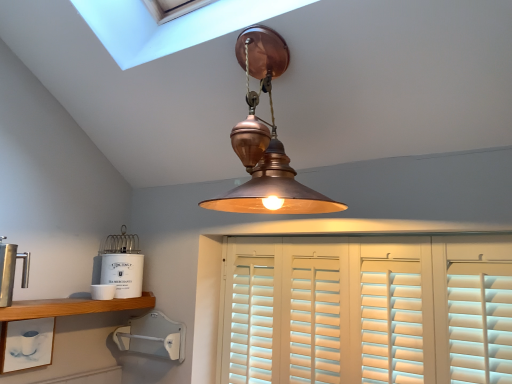
What do you see at coordinates (103, 291) in the screenshot? Image resolution: width=512 pixels, height=384 pixels. I see `white ceramic container at lower left, which appears as the second appliance when ordered from the bottom` at bounding box center [103, 291].

How much space does white ceramic container at lower left, the 3th appliance positioned from the top, occupy horizontally?

The width of white ceramic container at lower left, the 3th appliance positioned from the top, is 8.36 centimeters.

What do you see at coordinates (71, 307) in the screenshot? The width and height of the screenshot is (512, 384). I see `wooden shelf at lower left, the 1th shelf positioned from the top` at bounding box center [71, 307].

What do you see at coordinates (122, 264) in the screenshot? I see `white matte tea canister at left, which ranks as the third appliance in bottom-to-top order` at bounding box center [122, 264].

Find the location of a particular element. Image resolution: width=512 pixels, height=384 pixels. white plastic wall mount at lower left, which ranks as the first appliance in bottom-to-top order is located at coordinates (153, 336).

This screenshot has height=384, width=512. What do you see at coordinates (368, 310) in the screenshot?
I see `white wood shutters at center` at bounding box center [368, 310].

This screenshot has width=512, height=384. I want to click on white ceramic container at lower left, which appears as the second appliance when ordered from the bottom, so click(103, 291).

Is point (152, 315) behind point (125, 279)?

Yes, point (152, 315) is behind point (125, 279).

Where is `appliance on the right side of white matte tea canister at left, which is counted as the 2th appliance, starting from the top`? The width and height of the screenshot is (512, 384). appliance on the right side of white matte tea canister at left, which is counted as the 2th appliance, starting from the top is located at coordinates (153, 336).

Could you tell me if white plastic wall mount at lower left, the 4th appliance viewed from the top, is facing white matte tea canister at left, which is counted as the 2th appliance, starting from the top?

No, white plastic wall mount at lower left, the 4th appliance viewed from the top, does not turn towards white matte tea canister at left, which is counted as the 2th appliance, starting from the top.

Are wooden shelf at lower left, the 1th shelf positioned from the top, and copper pendant light at center far apart?

wooden shelf at lower left, the 1th shelf positioned from the top, is actually quite close to copper pendant light at center.

Considering the positions of point (23, 311) and point (249, 203), is point (23, 311) closer or farther from the camera than point (249, 203)?

Point (23, 311) appears to be farther away from the viewer than point (249, 203).

Consider the image. From a real-world perspective, relative to copper pendant light at center, is wooden shelf at lower left, acting as the 2th shelf starting from the bottom, vertically above or below?

From a real-world perspective, wooden shelf at lower left, acting as the 2th shelf starting from the bottom, is physically below copper pendant light at center.

Is wooden shelf at lower left, the 1th shelf positioned from the top, oriented towards copper pendant light at center?

No, wooden shelf at lower left, the 1th shelf positioned from the top, is not aimed at copper pendant light at center.

Does polished stainless steel coffee press at left, which ranks as the fourth appliance in bottom-to-top order, lie behind white matte tea canister at left, which ranks as the third appliance in bottom-to-top order?

No, the depth of polished stainless steel coffee press at left, which ranks as the fourth appliance in bottom-to-top order, is less than that of white matte tea canister at left, which ranks as the third appliance in bottom-to-top order.

Considering the positions of points (23, 259) and (118, 281), is point (23, 259) farther from camera compared to point (118, 281)?

No, (23, 259) is in front of (118, 281).

Identify the location of appliance above the white matte tea canister at left, which is counted as the 2th appliance, starting from the top (from a real-world perspective). This screenshot has height=384, width=512. (11, 271).

From a real-world perspective, which is physically above, polished stainless steel coffee press at left, which ranks as the fourth appliance in bottom-to-top order, or white matte tea canister at left, which ranks as the third appliance in bottom-to-top order?

polished stainless steel coffee press at left, which ranks as the fourth appliance in bottom-to-top order, is physically above.

Is white matte tea canister at left, which ranks as the third appliance in bottom-to-top order, aimed at white matte cup at lower left, the 2th shelf in the top-to-bottom sequence?

No.

What's the angular difference between white matte tea canister at left, which is counted as the 2th appliance, starting from the top, and white matte cup at lower left, placed as the 1th shelf when sorted from bottom to top,'s facing directions?

The angular difference between white matte tea canister at left, which is counted as the 2th appliance, starting from the top, and white matte cup at lower left, placed as the 1th shelf when sorted from bottom to top, is 7.1 degrees.

Is white matte tea canister at left, which ranks as the third appliance in bottom-to-top order, not inside white matte cup at lower left, placed as the 1th shelf when sorted from bottom to top?

That's correct, white matte tea canister at left, which ranks as the third appliance in bottom-to-top order, is outside of white matte cup at lower left, placed as the 1th shelf when sorted from bottom to top.

Which point is more forward, (135, 234) or (42, 348)?

The point (42, 348) is closer.

From the image's perspective, is white wood shutters at center positioned above or below copper pendant light at center?

white wood shutters at center is situated lower than copper pendant light at center in the image.

Consider the image. Is white wood shutters at center aimed at copper pendant light at center?

No, white wood shutters at center is not aimed at copper pendant light at center.

Find the location of a particular element. lamp positioned vertically above the white wood shutters at center (from a real-world perspective) is located at coordinates (266, 140).

Which of these two, white matte cup at lower left, placed as the 1th shelf when sorted from bottom to top, or white plastic wall mount at lower left, the 4th appliance viewed from the top, is bigger?

With larger size is white plastic wall mount at lower left, the 4th appliance viewed from the top.

Could you tell me if white matte cup at lower left, placed as the 1th shelf when sorted from bottom to top, is facing white plastic wall mount at lower left, the 4th appliance viewed from the top?

No, white matte cup at lower left, placed as the 1th shelf when sorted from bottom to top, is not oriented towards white plastic wall mount at lower left, the 4th appliance viewed from the top.

Is white matte cup at lower left, placed as the 1th shelf when sorted from bottom to top, taller or shorter than white plastic wall mount at lower left, which ranks as the first appliance in bottom-to-top order?

Clearly, white matte cup at lower left, placed as the 1th shelf when sorted from bottom to top, is taller compared to white plastic wall mount at lower left, which ranks as the first appliance in bottom-to-top order.

How different are the orientations of white matte cup at lower left, the 2th shelf in the top-to-bottom sequence, and white plastic wall mount at lower left, which ranks as the first appliance in bottom-to-top order, in degrees?

The angular difference between white matte cup at lower left, the 2th shelf in the top-to-bottom sequence, and white plastic wall mount at lower left, which ranks as the first appliance in bottom-to-top order, is 89 degrees.

From a real-world perspective, which object rests below the other?

white matte cup at lower left, the 2th shelf in the top-to-bottom sequence, is physically lower.

Locate an element on the screen. This screenshot has height=384, width=512. shelf in front of the white matte cup at lower left, the 2th shelf in the top-to-bottom sequence is located at coordinates (71, 307).

Is white matte cup at lower left, placed as the 1th shelf when sorted from bottom to top, facing away from wooden shelf at lower left, acting as the 2th shelf starting from the bottom?

No, white matte cup at lower left, placed as the 1th shelf when sorted from bottom to top, is not facing away from wooden shelf at lower left, acting as the 2th shelf starting from the bottom.

You are a GUI agent. You are given a task and a screenshot of the screen. Output one action in this format:
    pyautogui.click(x=<x>, y=<y>)
    Task: Click on the appliance that is the 1st object to the left of the white plastic wall mount at lower left, which ranks as the first appliance in bottom-to-top order, starting at the anchor
    
    Given the screenshot: What is the action you would take?
    pyautogui.click(x=122, y=264)

Starting from the copper pendant light at center, which shelf is the 1st one behind? Please provide its 2D coordinates.

[(71, 307)]

Based on their spatial positions, is polished stainless steel coffee press at left, which ranks as the fourth appliance in bottom-to-top order, or white ceramic container at lower left, the 3th appliance positioned from the top, further from white plastic wall mount at lower left, which ranks as the first appliance in bottom-to-top order?

polished stainless steel coffee press at left, which ranks as the fourth appliance in bottom-to-top order, is further to white plastic wall mount at lower left, which ranks as the first appliance in bottom-to-top order.

Which object lies nearer to the anchor point white plastic wall mount at lower left, which ranks as the first appliance in bottom-to-top order, white wood shutters at center or white matte cup at lower left, placed as the 1th shelf when sorted from bottom to top?

Among the two, white matte cup at lower left, placed as the 1th shelf when sorted from bottom to top, is located nearer to white plastic wall mount at lower left, which ranks as the first appliance in bottom-to-top order.

Considering their positions, is copper pendant light at center positioned further to white matte cup at lower left, the 2th shelf in the top-to-bottom sequence, than white plastic wall mount at lower left, which ranks as the first appliance in bottom-to-top order?

copper pendant light at center.

Considering their positions, is wooden shelf at lower left, the 1th shelf positioned from the top, positioned further to white plastic wall mount at lower left, which ranks as the first appliance in bottom-to-top order, than polished stainless steel coffee press at left, which ranks as the fourth appliance in bottom-to-top order?

polished stainless steel coffee press at left, which ranks as the fourth appliance in bottom-to-top order, is further to white plastic wall mount at lower left, which ranks as the first appliance in bottom-to-top order.

When comparing their distances from white matte tea canister at left, which is counted as the 2th appliance, starting from the top, does white matte cup at lower left, the 2th shelf in the top-to-bottom sequence, or polished stainless steel coffee press at left, the 1th appliance viewed from the top, seem further?

Among the two, polished stainless steel coffee press at left, the 1th appliance viewed from the top, is located further to white matte tea canister at left, which is counted as the 2th appliance, starting from the top.

Based on their spatial positions, is white ceramic container at lower left, the 3th appliance positioned from the top, or copper pendant light at center closer to wooden shelf at lower left, acting as the 2th shelf starting from the bottom?

white ceramic container at lower left, the 3th appliance positioned from the top.

Based on their spatial positions, is copper pendant light at center or white plastic wall mount at lower left, the 4th appliance viewed from the top, closer to wooden shelf at lower left, the 1th shelf positioned from the top?

white plastic wall mount at lower left, the 4th appliance viewed from the top.

From the image, which object appears to be farther from white wood shutters at center, white plastic wall mount at lower left, which ranks as the first appliance in bottom-to-top order, or wooden shelf at lower left, the 1th shelf positioned from the top?

wooden shelf at lower left, the 1th shelf positioned from the top, is positioned further to the anchor white wood shutters at center.

What are the coordinates of `shelf between white matte cup at lower left, placed as the 1th shelf when sorted from bottom to top, and copper pendant light at center from left to right` in the screenshot? It's located at (71, 307).

You are a GUI agent. You are given a task and a screenshot of the screen. Output one action in this format:
    pyautogui.click(x=<x>, y=<y>)
    Task: Click on the shelf between white matte cup at lower left, the 2th shelf in the top-to-bottom sequence, and white wood shutters at center, in the horizontal direction
    This screenshot has height=384, width=512.
    Given the screenshot: What is the action you would take?
    pyautogui.click(x=71, y=307)

You are a GUI agent. You are given a task and a screenshot of the screen. Output one action in this format:
    pyautogui.click(x=<x>, y=<y>)
    Task: Click on the lamp located between polished stainless steel coffee press at left, the 1th appliance viewed from the top, and white wood shutters at center in the left-right direction
    The width and height of the screenshot is (512, 384).
    Given the screenshot: What is the action you would take?
    pyautogui.click(x=266, y=140)

Image resolution: width=512 pixels, height=384 pixels. In order to click on lamp located between white matte cup at lower left, placed as the 1th shelf when sorted from bottom to top, and white wood shutters at center in the left-right direction in this screenshot , I will do `click(266, 140)`.